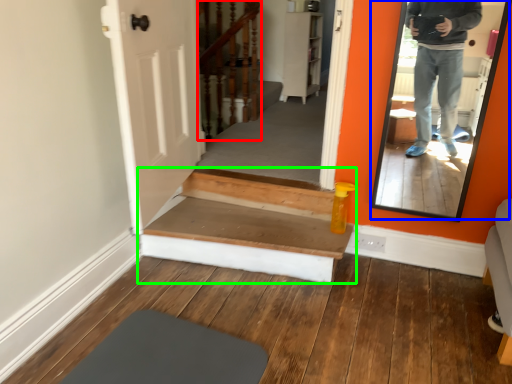
Question: Based on their relative distances, which object is nearer to stairwell (highlighted by a red box)? Choose from mirror (highlighted by a blue box) and stairs (highlighted by a green box).

Choices:
 (A) mirror
 (B) stairs

Answer: (B)